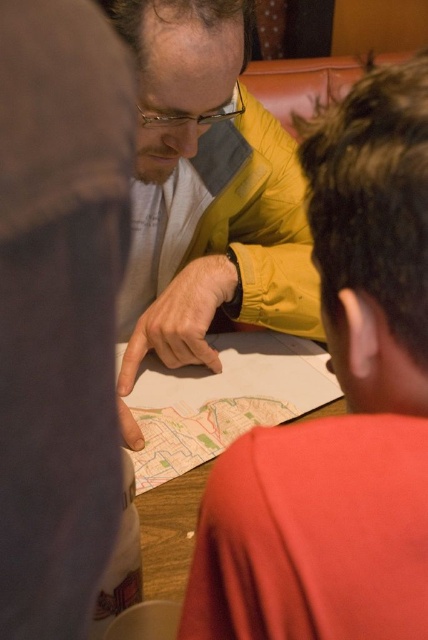
Where is the yellow matte jacket at center located in the image?

The yellow matte jacket at center is located at point (208, 192).

You are a photographer trying to capture a closeup of the map while keeping both the yellow matte jacket at center and the white cotton shirt at center visible in the frame. Which object should you focus on to ensure both are in focus?

The yellow matte jacket at center is much taller than the white cotton shirt at center, so focusing on the yellow matte jacket at center will ensure both are in focus.

You are standing at the edge of the room and want to see the point marked at coordinates (x=199, y=445) on the map. Where should you look?

The point marked at coordinates (x=199, y=445) is on the wooden table at center, so you should look at the wooden table at center to see it.